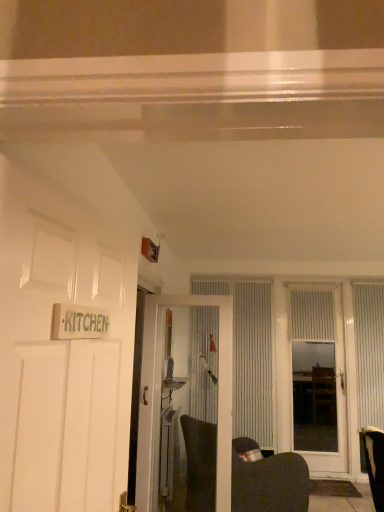
Question: Does white textured curtain at center, which ranks as the third curtain in right-to-left order, come behind white glossy door at left, which is the third door in right-to-left order?

Choices:
 (A) yes
 (B) no

Answer: (A)

Question: Is white textured curtain at center, the first curtain in the left-to-right sequence, oriented away from white glossy door at left, the first door when ordered from left to right?

Choices:
 (A) no
 (B) yes

Answer: (A)

Question: From the image's perspective, is white textured curtain at center, which ranks as the third curtain in right-to-left order, below white glossy door at left, the first door when ordered from left to right?

Choices:
 (A) yes
 (B) no

Answer: (A)

Question: Can we say white textured curtain at center, the first curtain in the left-to-right sequence, lies outside white glossy door at left, the first door when ordered from left to right?

Choices:
 (A) no
 (B) yes

Answer: (B)

Question: Can you confirm if white textured curtain at center, the first curtain in the left-to-right sequence, is bigger than white glossy door at left, the first door when ordered from left to right?

Choices:
 (A) yes
 (B) no

Answer: (A)

Question: Considering the relative positions of white textured curtain at center, the first curtain in the left-to-right sequence, and white glossy door at left, the 3th door viewed from the back, in the image provided, is white textured curtain at center, the first curtain in the left-to-right sequence, to the left of white glossy door at left, the 3th door viewed from the back, from the viewer's perspective?

Choices:
 (A) yes
 (B) no

Answer: (B)

Question: Does white textured curtain at center, which ranks as the third curtain in right-to-left order, have a lesser width compared to white textured door at center, the second door viewed from the front?

Choices:
 (A) no
 (B) yes

Answer: (B)

Question: Is white textured curtain at center, the first curtain in the left-to-right sequence, positioned behind white textured door at center, which is the second door in left-to-right order?

Choices:
 (A) no
 (B) yes

Answer: (B)

Question: Is white textured curtain at center, the first curtain in the left-to-right sequence, oriented away from white textured door at center, the second door viewed from the front?

Choices:
 (A) no
 (B) yes

Answer: (A)

Question: Does white textured curtain at center, the first curtain in the left-to-right sequence, have a greater height compared to white textured door at center, the second door viewed from the front?

Choices:
 (A) yes
 (B) no

Answer: (A)

Question: Considering the relative sizes of white textured curtain at center, the first curtain in the left-to-right sequence, and white textured door at center, the 2th door viewed from the right, in the image provided, is white textured curtain at center, the first curtain in the left-to-right sequence, wider than white textured door at center, the 2th door viewed from the right,?

Choices:
 (A) yes
 (B) no

Answer: (B)

Question: From the image's perspective, is white textured curtain at center, the first curtain in the left-to-right sequence, located above white textured door at center, the second door viewed from the back?

Choices:
 (A) yes
 (B) no

Answer: (B)

Question: Considering the relative positions of white textured door at center, which is the second door in left-to-right order, and white textured door at center, which is counted as the 1th door, starting from the back, in the image provided, is white textured door at center, which is the second door in left-to-right order, to the left of white textured door at center, which is counted as the 1th door, starting from the back, from the viewer's perspective?

Choices:
 (A) no
 (B) yes

Answer: (B)